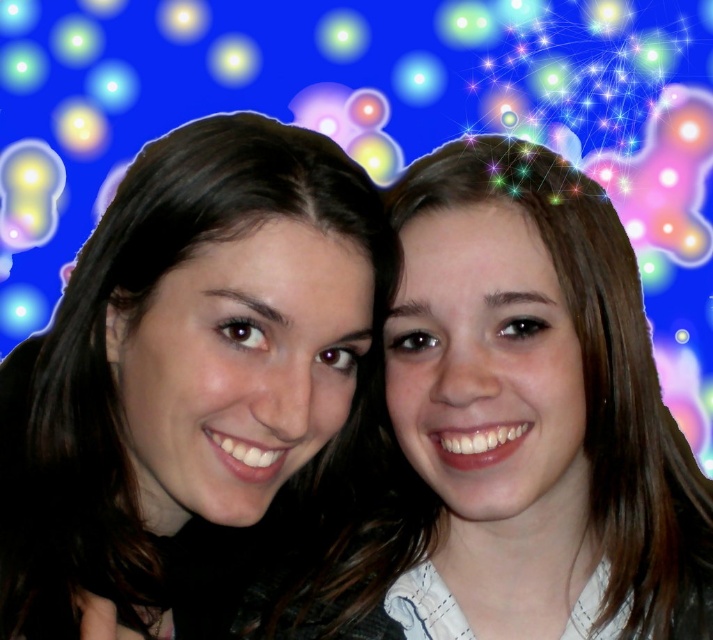
You are a photographer trying to capture a group photo. You see two people with smooth skin face at center and smooth skin face at right. Which face should you focus on first to ensure both are in frame?

The smooth skin face at center is located below the smooth skin face at right. To ensure both are in frame, focus on the smooth skin face at right first as it is higher up, then adjust to include the lower one.

You are taking a photo of two friends and want to ensure their faces are centered in the frame. Given the smooth skin face at center and the smooth skin face at right, which one is positioned to the left?

The smooth skin face at center is positioned to the left of the smooth skin face at right.

From the picture: You are taking a photo of two friends and want to ensure both faces are in focus. Given the smooth skin face at center and the smooth skin face at right, which face should you focus on first to ensure both are clear?

The smooth skin face at center is closer to the viewer than the smooth skin face at right. To ensure both faces are in focus, you should focus on the smooth skin face at center first, as it is closer, and adjust the depth of field accordingly.